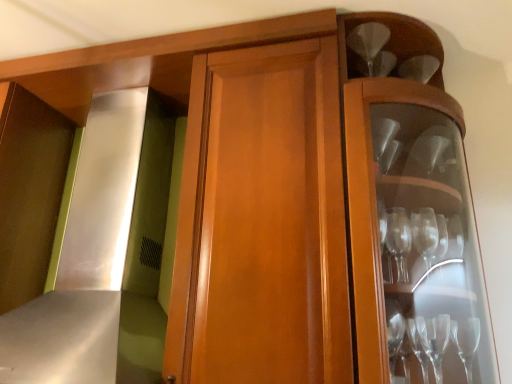
The image size is (512, 384). Describe the element at coordinates (108, 254) in the screenshot. I see `satin silver exhaust hood at left` at that location.

Locate an element on the screen. satin silver exhaust hood at left is located at coordinates (108, 254).

Describe the element at coordinates (368, 41) in the screenshot. This screenshot has width=512, height=384. I see `clear glass wine glass at upper right` at that location.

In order to face clear glass wine glass at upper right, should I rotate leftwards or rightwards?

A 14.952 degree turn to the right will do.

Locate an element on the screen. clear glass wine glass at upper right is located at coordinates (368, 41).

At what (x,y) coordinates should I click in order to perform the action: click on satin silver exhaust hood at left. Please return your answer as a coordinate pair (x, y). The image size is (512, 384). Looking at the image, I should click on (108, 254).

Considering the relative positions of clear glass wine glass at upper right and satin silver exhaust hood at left in the image provided, is clear glass wine glass at upper right to the left of satin silver exhaust hood at left from the viewer's perspective?

No, clear glass wine glass at upper right is not to the left of satin silver exhaust hood at left.

Considering their positions, is clear glass wine glass at upper right located in front of or behind satin silver exhaust hood at left?

In the image, clear glass wine glass at upper right appears behind satin silver exhaust hood at left.

Is point (364, 43) in front of point (135, 122)?

Yes, point (364, 43) is in front of point (135, 122).

In the scene shown: From the image's perspective, is clear glass wine glass at upper right located above or below satin silver exhaust hood at left?

clear glass wine glass at upper right is situated higher than satin silver exhaust hood at left in the image.

From a real-world perspective, is clear glass wine glass at upper right physically located above or below satin silver exhaust hood at left?

Clearly, from a real-world perspective, clear glass wine glass at upper right is above satin silver exhaust hood at left.

Looking at their sizes, would you say clear glass wine glass at upper right is wider or thinner than satin silver exhaust hood at left?

Clearly, clear glass wine glass at upper right has less width compared to satin silver exhaust hood at left.

Considering the sizes of objects clear glass wine glass at upper right and satin silver exhaust hood at left in the image provided, who is taller, clear glass wine glass at upper right or satin silver exhaust hood at left?

Standing taller between the two is satin silver exhaust hood at left.

Considering the relative sizes of clear glass wine glass at upper right and satin silver exhaust hood at left in the image provided, is clear glass wine glass at upper right smaller than satin silver exhaust hood at left?

Indeed, clear glass wine glass at upper right has a smaller size compared to satin silver exhaust hood at left.

Is satin silver exhaust hood at left completely or partially inside clear glass wine glass at upper right?

No.

Would you say clear glass wine glass at upper right is a long distance from satin silver exhaust hood at left?

No, clear glass wine glass at upper right is not far from satin silver exhaust hood at left.

Is clear glass wine glass at upper right facing away from satin silver exhaust hood at left?

That's not correct — clear glass wine glass at upper right is not looking away from satin silver exhaust hood at left.

What's the angular difference between clear glass wine glass at upper right and satin silver exhaust hood at left's facing directions?

There is a 0.00187-degree angle between the facing directions of clear glass wine glass at upper right and satin silver exhaust hood at left.

This screenshot has width=512, height=384. Find the location of `wine glass above the satin silver exhaust hood at left (from the image's perspective)`. wine glass above the satin silver exhaust hood at left (from the image's perspective) is located at coordinates (368, 41).

Considering the positions of objects satin silver exhaust hood at left and clear glass wine glass at upper right in the image provided, who is more to the right, satin silver exhaust hood at left or clear glass wine glass at upper right?

From the viewer's perspective, clear glass wine glass at upper right appears more on the right side.

Relative to clear glass wine glass at upper right, is satin silver exhaust hood at left in front or behind?

satin silver exhaust hood at left is in front of clear glass wine glass at upper right.

Is point (118, 335) less distant than point (381, 48)?

Yes, point (118, 335) is closer to viewer.

From the image's perspective, relative to clear glass wine glass at upper right, is satin silver exhaust hood at left above or below?

Based on their image positions, satin silver exhaust hood at left is located beneath clear glass wine glass at upper right.

From a real-world perspective, between satin silver exhaust hood at left and clear glass wine glass at upper right, who is vertically higher?

clear glass wine glass at upper right.

Consider the image. Considering the sizes of objects satin silver exhaust hood at left and clear glass wine glass at upper right in the image provided, who is wider, satin silver exhaust hood at left or clear glass wine glass at upper right?

satin silver exhaust hood at left is wider.

Is satin silver exhaust hood at left shorter than clear glass wine glass at upper right?

In fact, satin silver exhaust hood at left may be taller than clear glass wine glass at upper right.

In terms of size, does satin silver exhaust hood at left appear bigger or smaller than clear glass wine glass at upper right?

In the image, satin silver exhaust hood at left appears to be larger than clear glass wine glass at upper right.

Do you think satin silver exhaust hood at left is within clear glass wine glass at upper right, or outside of it?

satin silver exhaust hood at left is not enclosed by clear glass wine glass at upper right.

Is satin silver exhaust hood at left not near clear glass wine glass at upper right?

No, satin silver exhaust hood at left is not far from clear glass wine glass at upper right.

Is satin silver exhaust hood at left looking in the opposite direction of clear glass wine glass at upper right?

satin silver exhaust hood at left is not turned away from clear glass wine glass at upper right.

How different are the orientations of satin silver exhaust hood at left and clear glass wine glass at upper right in degrees?

0.00187 degrees separate the facing orientations of satin silver exhaust hood at left and clear glass wine glass at upper right.

How far apart are satin silver exhaust hood at left and clear glass wine glass at upper right?

satin silver exhaust hood at left is 37.93 inches from clear glass wine glass at upper right.

What are the coordinates of `exhaust hood to the left of clear glass wine glass at upper right` in the screenshot? It's located at (108, 254).

In the image, there is a clear glass wine glass at upper right. Where is `exhaust hood below it (from the image's perspective)`? The image size is (512, 384). exhaust hood below it (from the image's perspective) is located at coordinates (108, 254).

Identify the location of exhaust hood that is on the left side of clear glass wine glass at upper right. (108, 254).